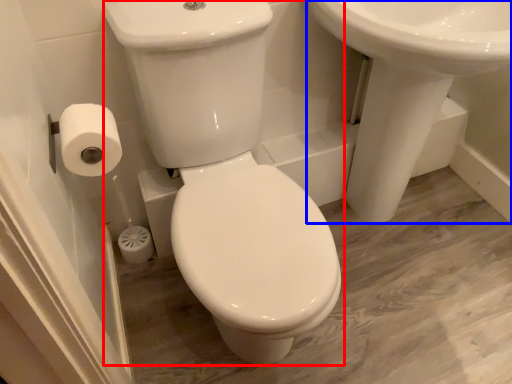
Question: Among these objects, which one is farthest to the camera, porcelain (highlighted by a red box) or sink (highlighted by a blue box)?

Choices:
 (A) porcelain
 (B) sink

Answer: (B)